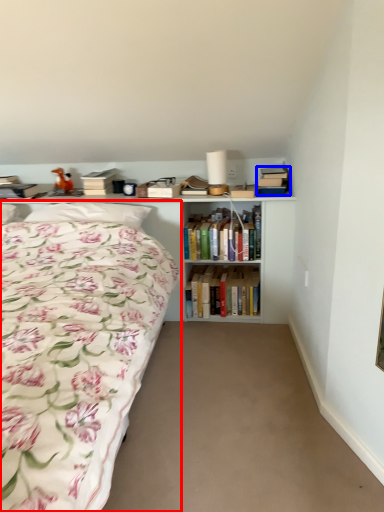
Question: Which of the following is the closest to the observer, bed (highlighted by a red box) or book (highlighted by a blue box)?

Choices:
 (A) bed
 (B) book

Answer: (A)